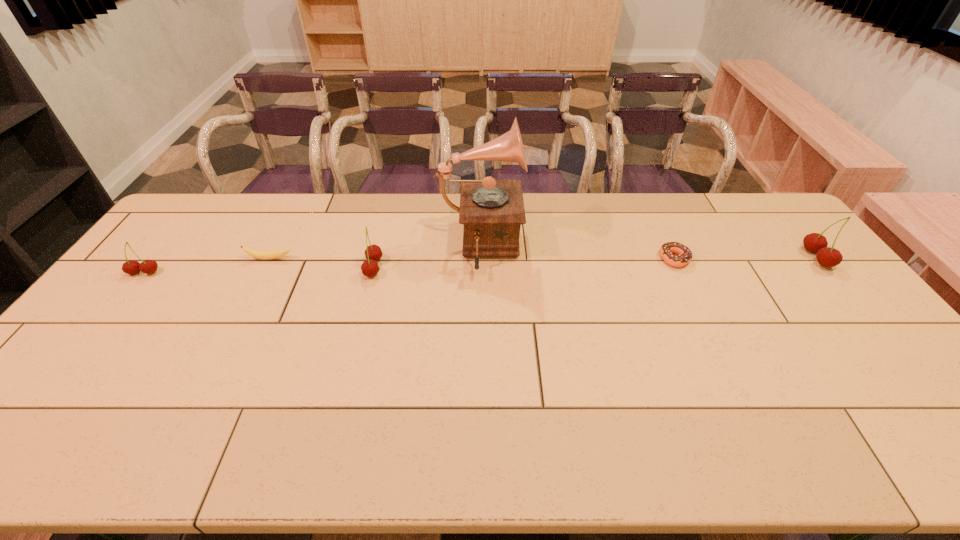
You are a GUI agent. You are given a task and a screenshot of the screen. Output one action in this format:
    pyautogui.click(x=<x>, y=<y>)
    Task: Click on the shortest object
    
    Given the screenshot: What is the action you would take?
    pyautogui.click(x=684, y=256)

You are a GUI agent. You are given a task and a screenshot of the screen. Output one action in this format:
    pyautogui.click(x=<x>, y=<y>)
    Task: Click on the blank area located 0.150m on the surface of the leftmost cherry
    The width and height of the screenshot is (960, 540).
    Given the screenshot: What is the action you would take?
    pyautogui.click(x=110, y=315)

Where is `free spot located on the surface of the third object from left to right`? The image size is (960, 540). free spot located on the surface of the third object from left to right is located at coordinates (466, 268).

Where is `vacant region located on the surface of the rightmost object`? This screenshot has width=960, height=540. vacant region located on the surface of the rightmost object is located at coordinates (756, 258).

I want to click on vacant space located on the surface of the rightmost object, so click(x=688, y=258).

The width and height of the screenshot is (960, 540). I want to click on free region located 0.200m on the surface of the rightmost object, so click(744, 258).

You are a GUI agent. You are given a task and a screenshot of the screen. Output one action in this format:
    pyautogui.click(x=<x>, y=<y>)
    Task: Click on the free space located 0.240m on the upward curve of the banana
    The height and width of the screenshot is (540, 960).
    Given the screenshot: What is the action you would take?
    pyautogui.click(x=240, y=318)

I want to click on vacant space located 0.330m on the horn of the third object from right to left, so click(623, 248).

I want to click on vacant space located on the right of the doughnut, so click(746, 259).

Identify the location of object situated at the far edge. This screenshot has height=540, width=960. (492, 211).